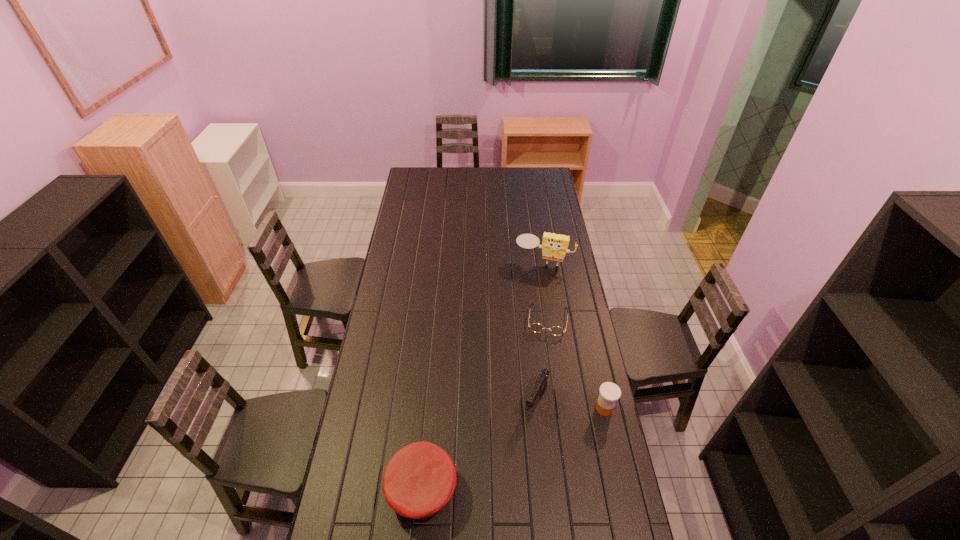
You are a GUI agent. You are given a task and a screenshot of the screen. Output one action in this format:
    pyautogui.click(x=<x>, y=<y>)
    Task: Click on the free space located at the barrel of the pistol
    The height and width of the screenshot is (540, 960).
    Given the screenshot: What is the action you would take?
    pyautogui.click(x=491, y=504)

You are a GUI agent. You are given a task and a screenshot of the screen. Output one action in this format:
    pyautogui.click(x=<x>, y=<y>)
    Task: Click on the vacant region located at the barrel of the pistol
    The image size is (960, 540).
    Given the screenshot: What is the action you would take?
    pyautogui.click(x=511, y=462)

In order to click on object that is positioned at the near edge in this screenshot , I will do `click(420, 478)`.

Find the location of a particular element. This screenshot has width=960, height=540. object that is at the left edge is located at coordinates (420, 478).

In order to click on medicine situated at the right edge in this screenshot , I will do `click(609, 392)`.

This screenshot has height=540, width=960. Identify the location of spectacles present at the right edge. (535, 327).

Where is `sponge that is at the right edge`? Image resolution: width=960 pixels, height=540 pixels. sponge that is at the right edge is located at coordinates pos(554,247).

Identify the location of object present at the near left corner. The height and width of the screenshot is (540, 960). (420, 478).

This screenshot has width=960, height=540. Find the location of `free space at the far edge`. free space at the far edge is located at coordinates 445,177.

Identify the location of blank area at the left edge. This screenshot has width=960, height=540. click(x=401, y=253).